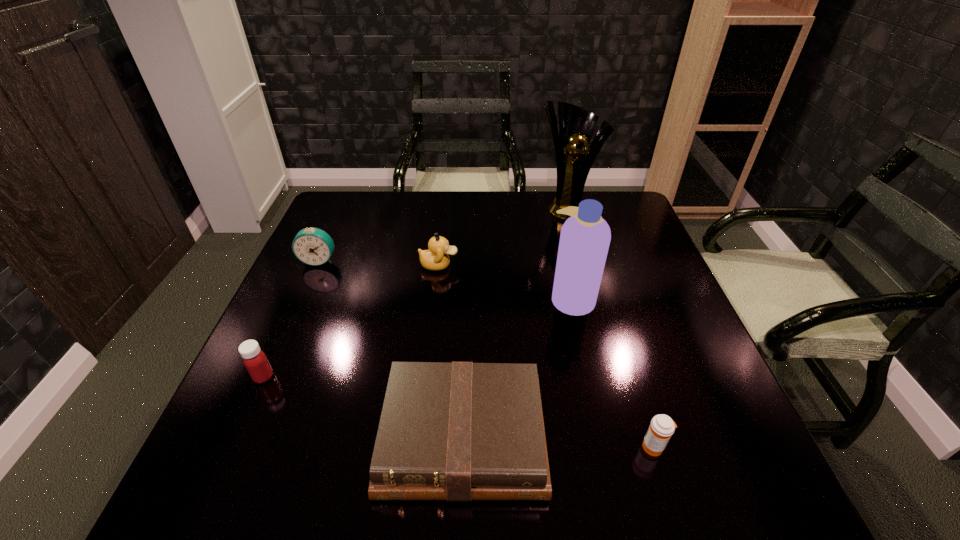
Locate an element on the screen. This screenshot has width=960, height=540. award is located at coordinates (576, 125).

Where is `the sixth shortest object`? This screenshot has width=960, height=540. the sixth shortest object is located at coordinates (585, 237).

Locate an element on the screen. Image resolution: width=960 pixels, height=540 pixels. the fourth nearest object is located at coordinates (585, 237).

Locate an element on the screen. alarm clock is located at coordinates 313,246.

Image resolution: width=960 pixels, height=540 pixels. Find the location of `duckling`. duckling is located at coordinates (436, 258).

Image resolution: width=960 pixels, height=540 pixels. I want to click on the farther medicine, so click(x=254, y=359).

Identify the location of the nearer medicine. (662, 427).

The height and width of the screenshot is (540, 960). What are the coordinates of `Bible` in the screenshot? It's located at (458, 431).

Where is `vacant space located 0.320m at the front of the award, where the globe is visible`? The width and height of the screenshot is (960, 540). vacant space located 0.320m at the front of the award, where the globe is visible is located at coordinates (x=588, y=290).

Locate an element on the screen. The width and height of the screenshot is (960, 540). vacant region located 0.200m on the front of the second tallest object is located at coordinates (592, 390).